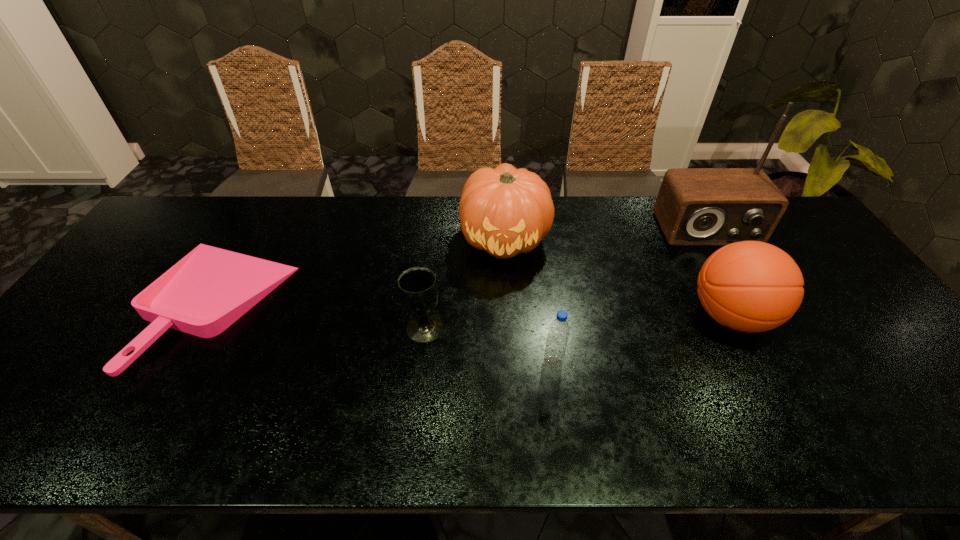
Identify the location of vacant area that satisfies the following two spatial constraints: 1. on the front-facing side of the radio receiver; 2. on the handle side of the dustpan. (749, 304).

This screenshot has width=960, height=540. In order to click on free region that satisfies the following two spatial constraints: 1. on the back side of the water bottle; 2. on the handle side of the shortest object in this screenshot , I will do `click(545, 304)`.

Where is `free region that satisfies the following two spatial constraints: 1. on the handle side of the water bottle; 2. on the right side of the dustpan`? free region that satisfies the following two spatial constraints: 1. on the handle side of the water bottle; 2. on the right side of the dustpan is located at coordinates (183, 362).

Locate an element on the screen. This screenshot has height=540, width=960. vacant region that satisfies the following two spatial constraints: 1. on the handle side of the water bottle; 2. on the left side of the shortest object is located at coordinates (183, 362).

I want to click on vacant area in the image that satisfies the following two spatial constraints: 1. on the front side of the water bottle; 2. on the right side of the chalice, so click(x=420, y=362).